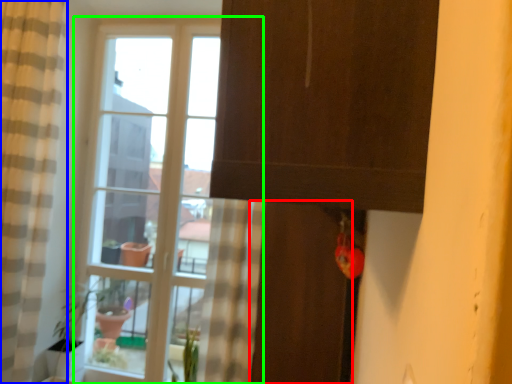
Question: Considering the real-world distances, which object is closest to screen door (highlighted by a red box)? curtain (highlighted by a blue box) or window (highlighted by a green box).

Choices:
 (A) curtain
 (B) window

Answer: (B)